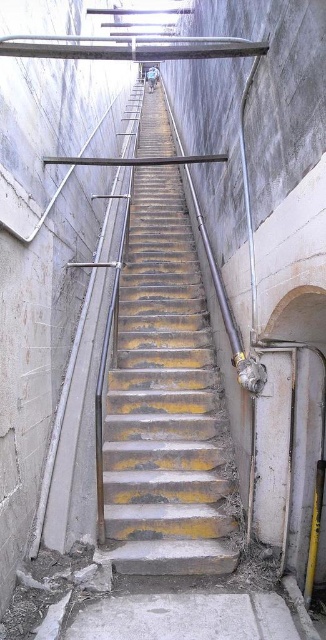
Is yellow painted metal stairs at center below gray concrete floor at bottom?

Incorrect, yellow painted metal stairs at center is not positioned below gray concrete floor at bottom.

Describe the element at coordinates (165, 403) in the screenshot. The image size is (326, 640). I see `yellow painted metal stairs at center` at that location.

Identify the location of yellow painted metal stairs at center. The width and height of the screenshot is (326, 640). (165, 403).